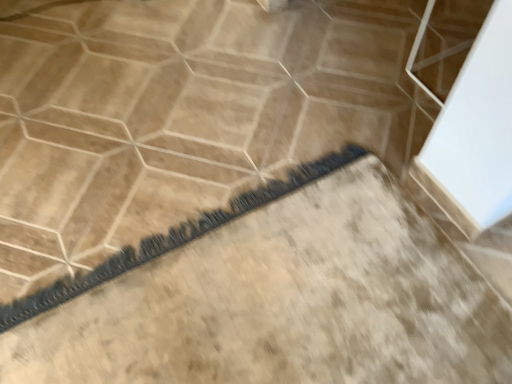
The width and height of the screenshot is (512, 384). What do you see at coordinates (273, 296) in the screenshot?
I see `carpeted stairs at lower right` at bounding box center [273, 296].

This screenshot has height=384, width=512. I want to click on carpeted stairs at lower right, so click(273, 296).

Find the location of `carpeted stairs at lower right`. carpeted stairs at lower right is located at coordinates (273, 296).